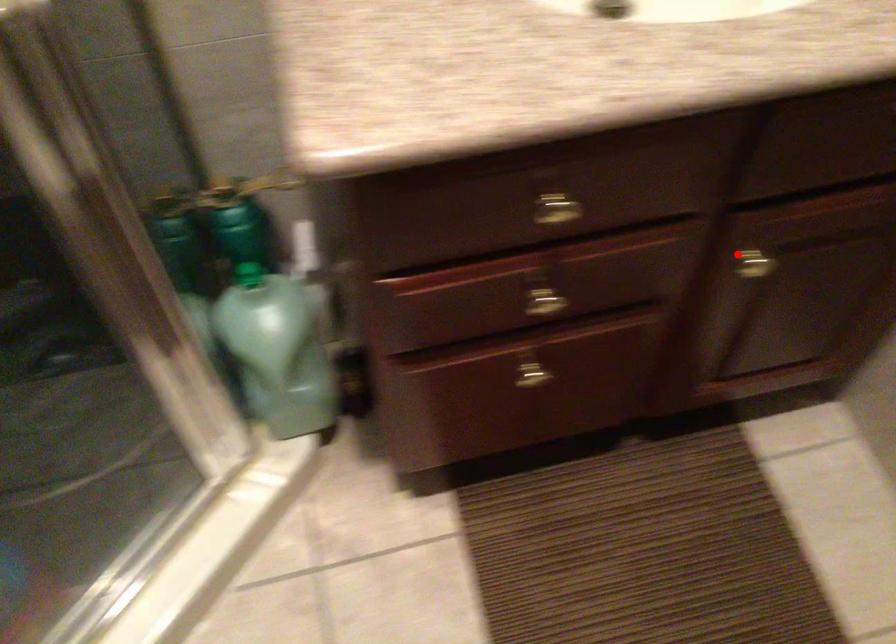
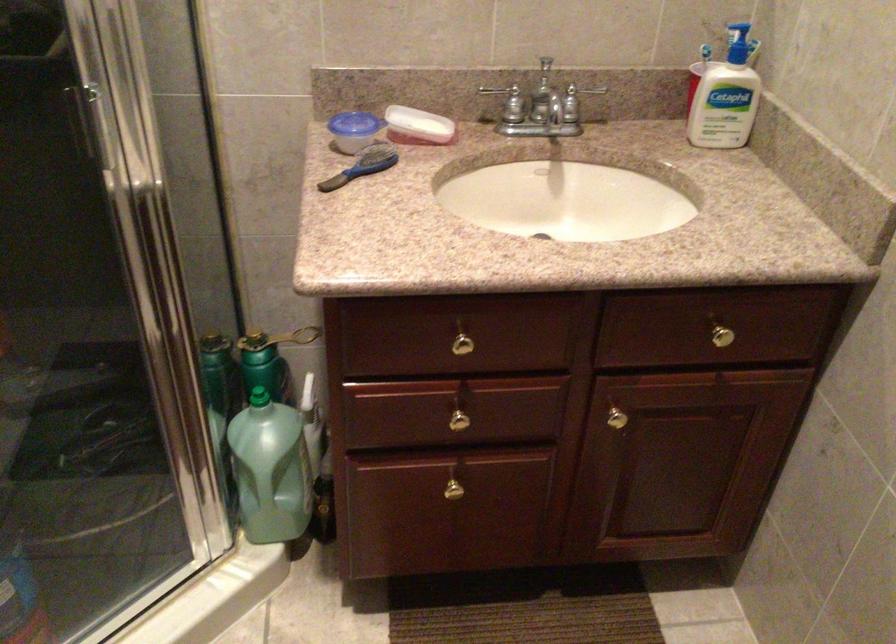
Question: I am providing you with two images of the same scene from different viewpoints. In image1, a red point is highlighted. Considering the same 3D point in image2, which of the following is correct?

Choices:
 (A) It is closer
 (B) It is farther

Answer: (B)